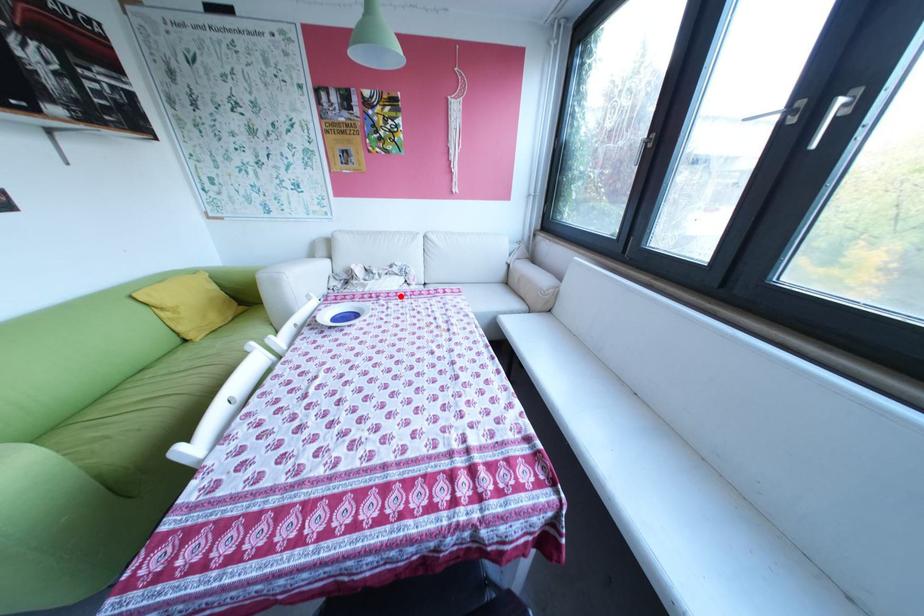
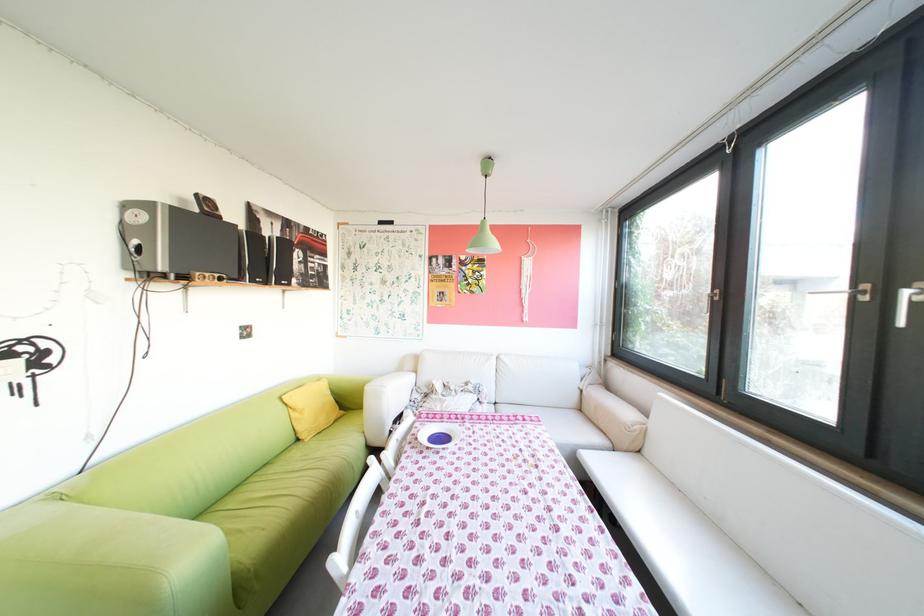
Where in the second image is the point corresponding to the highlighted location from the first image?

(484, 419)